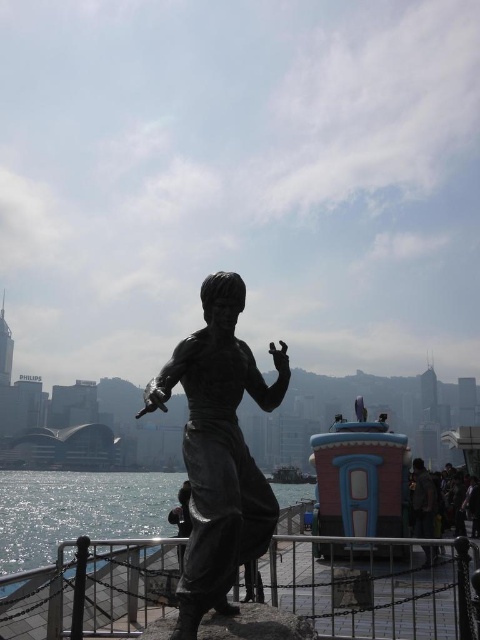
Which is behind, point (146, 577) or point (431, 554)?

The point (431, 554) is more distant.

Does metal/rusty rail at lower center appear on the right side of dark brown leather jacket at lower right?

No, metal/rusty rail at lower center is not to the right of dark brown leather jacket at lower right.

This screenshot has height=640, width=480. Describe the element at coordinates (372, 586) in the screenshot. I see `metal/rusty rail at lower center` at that location.

Where is `metal/rusty rail at lower center`? The image size is (480, 640). metal/rusty rail at lower center is located at coordinates (372, 586).

Is point (467, 608) positioned before point (58, 522)?

Yes, it is in front of point (58, 522).

Identify the location of metal/rusty rail at lower center. (372, 586).

Consider the image. Is bronze statue at center taller than dark brown leather jacket at lower right?

Correct, bronze statue at center is much taller as dark brown leather jacket at lower right.

Which is in front, point (191, 634) or point (420, 509)?

Point (191, 634)

I want to click on bronze statue at center, so click(x=218, y=451).